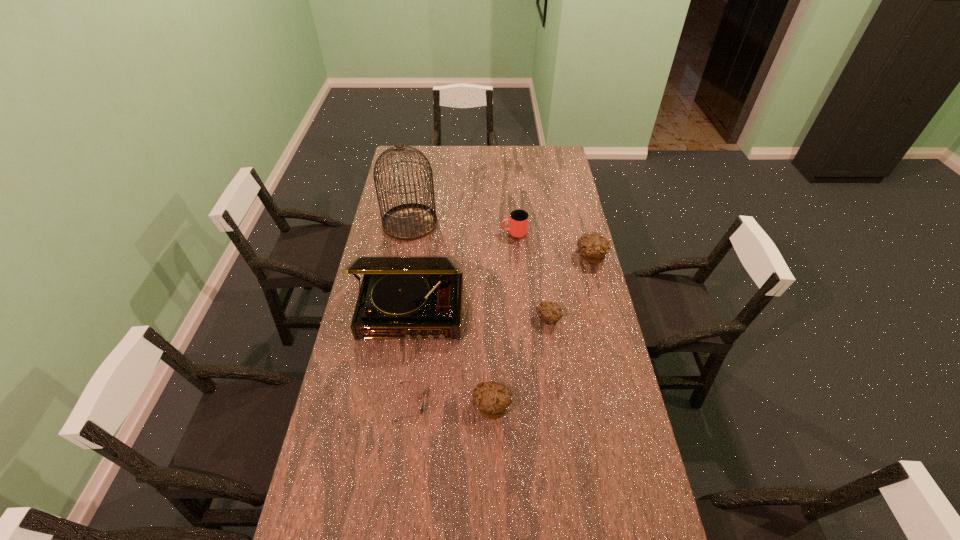
All muffins are currently evenly spaced. To continue this pattern, where would you add another muffin on the left? Please point out a vacant spot. Please provide its 2D coordinates. Your answer should be formatted as a tuple, i.e. [(x, y)], where the tuple contains the x and y coordinates of a point satisfying the conditions above.

[(414, 526)]